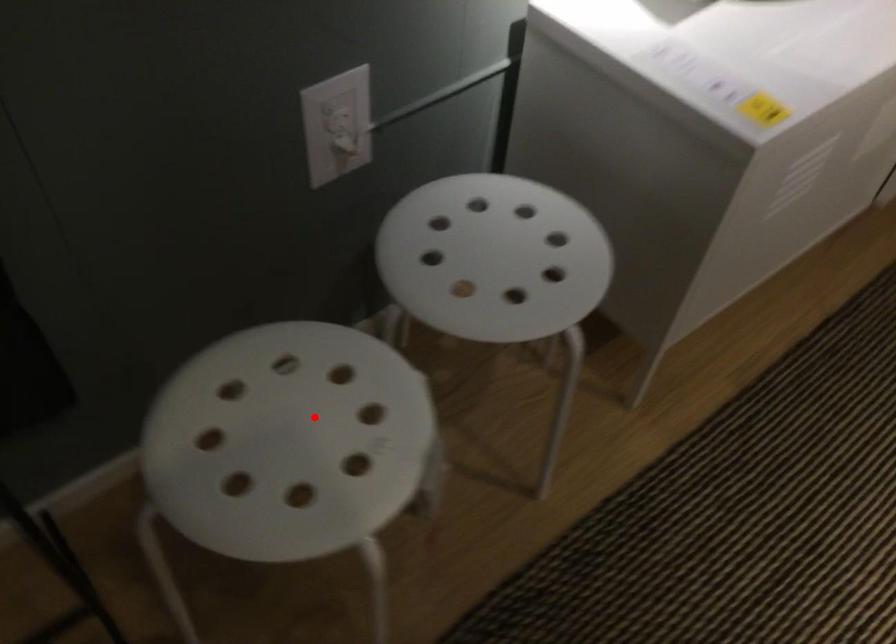
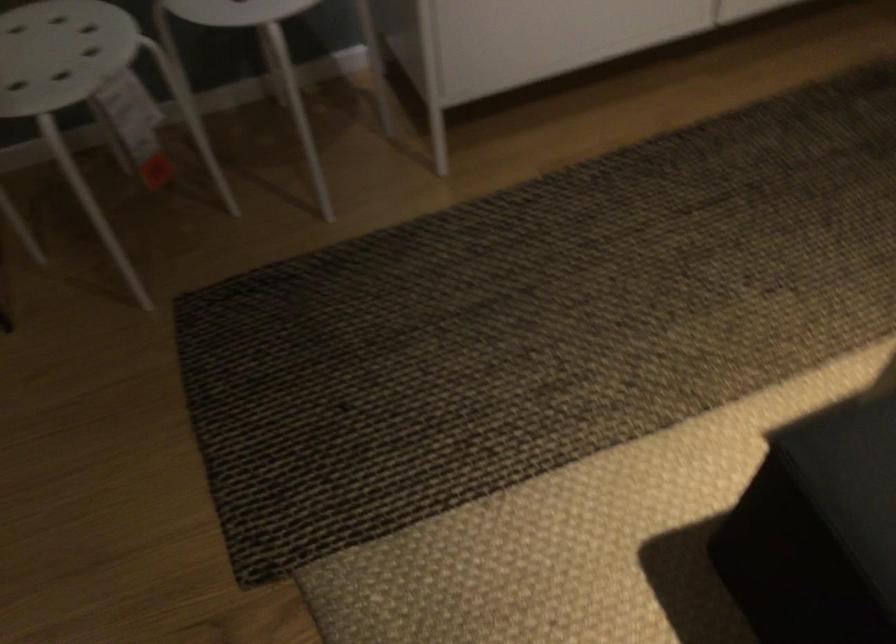
The point at the highlighted location is marked in the first image. Where is the corresponding point in the second image?

(61, 53)